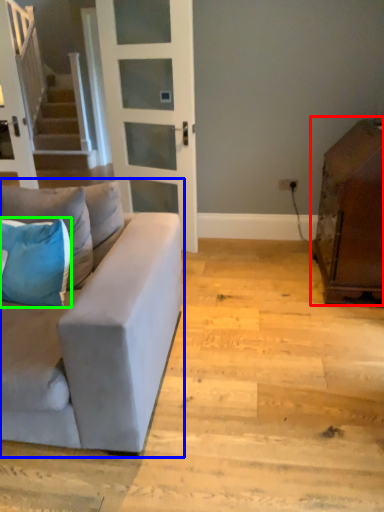
Question: Which object is positioned farthest from cabinetry (highlighted by a red box)? Select from studio couch (highlighted by a blue box) and pillow (highlighted by a green box).

Choices:
 (A) studio couch
 (B) pillow

Answer: (B)